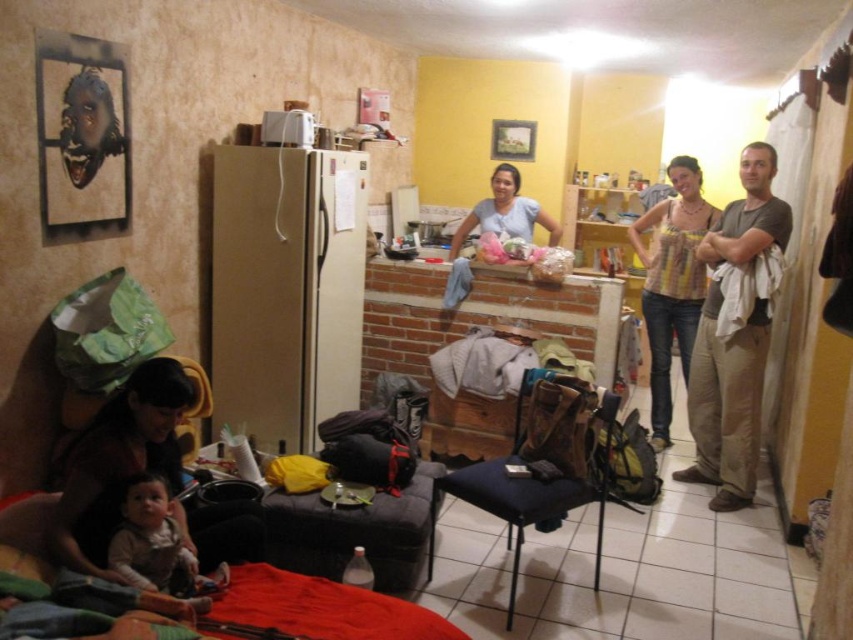
You are standing in the living room and want to pick up the brown cotton shirt at right. Where should you look to find it?

The brown cotton shirt at right is located at the 2D coordinates point (726, 404).

You are standing in the living room and need to place a 1.5 meter long object between the brown cotton shirt at right and the dark gray fabric stool at center. Is there enough space?

The brown cotton shirt at right is 1.75 meters away from the dark gray fabric stool at center, so yes, there is enough space to place a 1.5 meter long object between them.